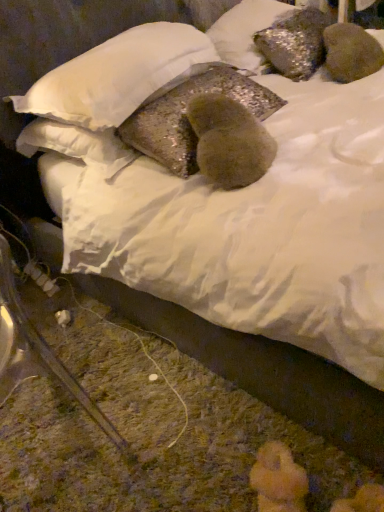
Question: Is glittery fabric pillow at center, the 3th pillow in the top-to-bottom sequence, bigger or smaller than sparkly metallic pillow at upper center, which is counted as the 1th pillow, starting from the top?

Choices:
 (A) small
 (B) big

Answer: (A)

Question: In the image, is glittery fabric pillow at center, marked as the first pillow in a bottom-to-top arrangement, positioned in front of or behind sparkly metallic pillow at upper center, the 3th pillow positioned from the bottom?

Choices:
 (A) front
 (B) behind

Answer: (A)

Question: Which object is positioned farthest from the sparkly metallic pillow at upper center, which is counted as the 1th pillow, starting from the top?

Choices:
 (A) glittery fabric pillow at center, the 3th pillow in the top-to-bottom sequence
 (B) shiny metallic pillow at center, the 2th pillow when ordered from top to bottom

Answer: (B)

Question: Based on their relative distances, which object is farther from the glittery fabric pillow at center, marked as the first pillow in a bottom-to-top arrangement?

Choices:
 (A) shiny metallic pillow at center, which is the second pillow from bottom to top
 (B) sparkly metallic pillow at upper center, which is counted as the 1th pillow, starting from the top

Answer: (B)